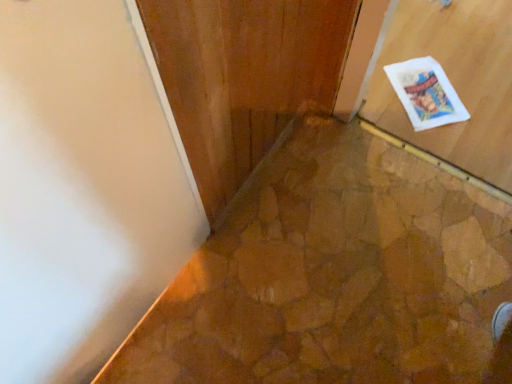
Identify the location of white paper postcard at upper right. (426, 93).

What do you see at coordinates (426, 93) in the screenshot? I see `white paper postcard at upper right` at bounding box center [426, 93].

What is the approximate height of white paper postcard at upper right?

white paper postcard at upper right is 0.95 inches tall.

Identify the location of matte wood door at upper right. (84, 187).

The image size is (512, 384). Describe the element at coordinates (84, 187) in the screenshot. I see `matte wood door at upper right` at that location.

What is the approximate height of matte wood door at upper right?

It is 38.92 inches.

This screenshot has height=384, width=512. Find the location of `white paper postcard at upper right`. white paper postcard at upper right is located at coordinates (426, 93).

Based on their positions, is white paper postcard at upper right located to the left or right of matte wood door at upper right?

white paper postcard at upper right is positioned on matte wood door at upper right's right side.

Is white paper postcard at upper right further to camera compared to matte wood door at upper right?

Yes.

Is point (424, 106) closer to viewer compared to point (85, 219)?

No, it is behind (85, 219).

From the image's perspective, is white paper postcard at upper right positioned above or below matte wood door at upper right?

Based on their image positions, white paper postcard at upper right is located above matte wood door at upper right.

From a real-world perspective, is white paper postcard at upper right over matte wood door at upper right?

No, from a real-world perspective, white paper postcard at upper right is not on top of matte wood door at upper right.

Considering the relative sizes of white paper postcard at upper right and matte wood door at upper right in the image provided, is white paper postcard at upper right thinner than matte wood door at upper right?

Incorrect, the width of white paper postcard at upper right is not less than that of matte wood door at upper right.

In terms of height, does white paper postcard at upper right look taller or shorter compared to matte wood door at upper right?

Clearly, white paper postcard at upper right is shorter compared to matte wood door at upper right.

Is white paper postcard at upper right bigger or smaller than matte wood door at upper right?

Clearly, white paper postcard at upper right is smaller in size than matte wood door at upper right.

Is matte wood door at upper right located within white paper postcard at upper right?

That's incorrect, matte wood door at upper right is not inside white paper postcard at upper right.

Is white paper postcard at upper right far away from matte wood door at upper right?

white paper postcard at upper right is far away from matte wood door at upper right.

Is white paper postcard at upper right aimed at matte wood door at upper right?

No, white paper postcard at upper right does not turn towards matte wood door at upper right.

What's the angular difference between white paper postcard at upper right and matte wood door at upper right's facing directions?

38.1 degrees.

Locate an element on the screen. postcard located above the matte wood door at upper right (from the image's perspective) is located at coordinates (426, 93).

Considering the relative positions of matte wood door at upper right and white paper postcard at upper right in the image provided, is matte wood door at upper right to the right of white paper postcard at upper right from the viewer's perspective?

No, matte wood door at upper right is not to the right of white paper postcard at upper right.

In the scene shown: Is matte wood door at upper right positioned in front of white paper postcard at upper right?

Yes, it is.

Is point (65, 6) closer to viewer compared to point (403, 78)?

Yes, point (65, 6) is closer to viewer.

From the image's perspective, is matte wood door at upper right located above or below white paper postcard at upper right?

From the image's perspective, matte wood door at upper right appears below white paper postcard at upper right.

From a real-world perspective, is matte wood door at upper right located higher than white paper postcard at upper right?

Yes, from a real-world perspective, matte wood door at upper right is over white paper postcard at upper right

Which object is thinner, matte wood door at upper right or white paper postcard at upper right?

matte wood door at upper right.

Can you confirm if matte wood door at upper right is taller than white paper postcard at upper right?

Correct, matte wood door at upper right is much taller as white paper postcard at upper right.

Can you confirm if matte wood door at upper right is bigger than white paper postcard at upper right?

Indeed, matte wood door at upper right has a larger size compared to white paper postcard at upper right.

Do you think matte wood door at upper right is within white paper postcard at upper right, or outside of it?

matte wood door at upper right exists outside the volume of white paper postcard at upper right.

Is matte wood door at upper right not near white paper postcard at upper right?

Yes, matte wood door at upper right is far from white paper postcard at upper right.

Is matte wood door at upper right facing towards white paper postcard at upper right?

No, matte wood door at upper right does not turn towards white paper postcard at upper right.

What's the angular difference between matte wood door at upper right and white paper postcard at upper right's facing directions?

The angular difference between matte wood door at upper right and white paper postcard at upper right is 38.1 degrees.

This screenshot has width=512, height=384. In order to click on postcard behind the matte wood door at upper right in this screenshot , I will do `click(426, 93)`.

The width and height of the screenshot is (512, 384). I want to click on postcard on the right of matte wood door at upper right, so click(426, 93).

Where is `postcard that is above the matte wood door at upper right (from the image's perspective)`? This screenshot has height=384, width=512. postcard that is above the matte wood door at upper right (from the image's perspective) is located at coordinates (426, 93).